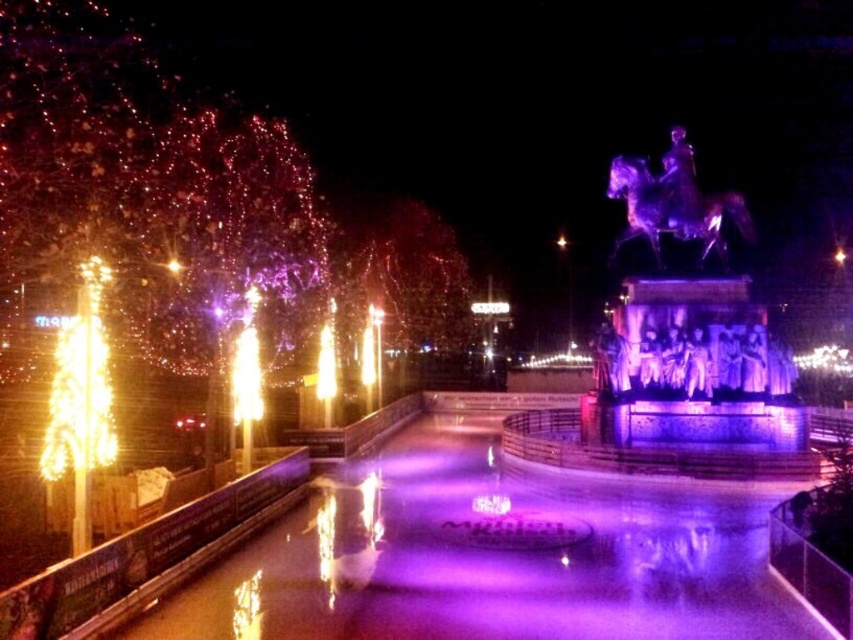
Who is taller, purple glossy statue at center or metallic statue at upper right?

Standing taller between the two is metallic statue at upper right.

This screenshot has width=853, height=640. Identify the location of purple glossy statue at center. (689, 355).